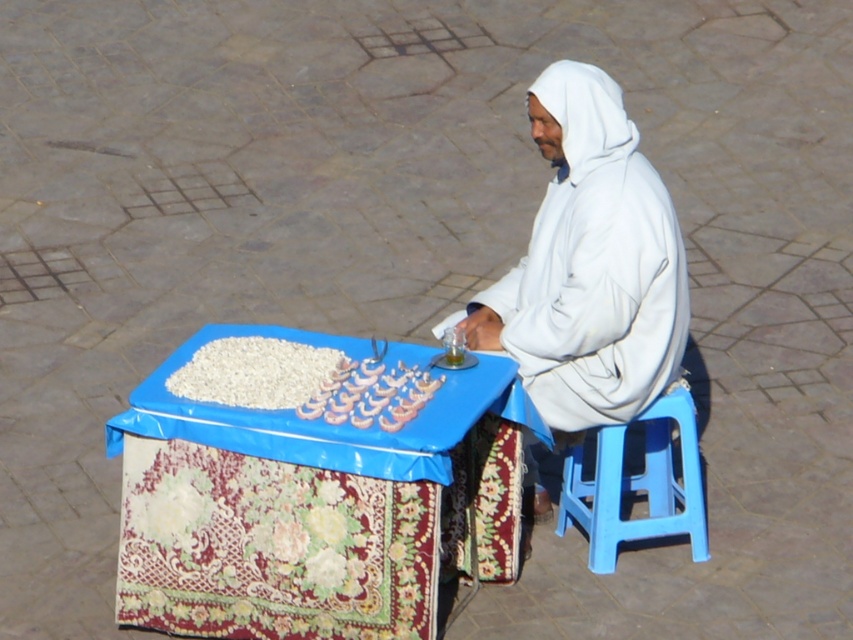
Question: Estimate the real-world distances between objects in this image. Which object is closer to the white matte hoodie at center?

Choices:
 (A) white glossy shrimp at center
 (B) blue plastic stool at lower right

Answer: (B)

Question: Is blue fabric-covered table at center positioned before white glossy shrimp at center?

Choices:
 (A) no
 (B) yes

Answer: (B)

Question: Can you confirm if blue fabric-covered table at center is positioned to the right of white matte grains at center?

Choices:
 (A) yes
 (B) no

Answer: (A)

Question: Is blue fabric-covered table at center to the right of white glossy shrimp at center from the viewer's perspective?

Choices:
 (A) yes
 (B) no

Answer: (B)

Question: Which object is closer to the camera taking this photo?

Choices:
 (A) white matte hoodie at center
 (B) white matte grains at center
 (C) white glossy shrimp at center
 (D) blue fabric-covered table at center

Answer: (D)

Question: Which object is closer to the camera taking this photo?

Choices:
 (A) white matte hoodie at center
 (B) white matte grains at center

Answer: (B)